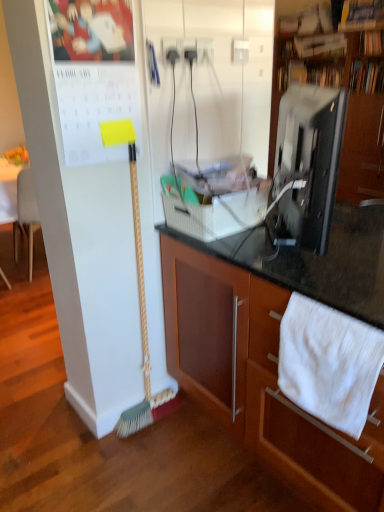
Question: Is white cotton towel at lower right inside or outside of green bristle broom at left?

Choices:
 (A) outside
 (B) inside

Answer: (A)

Question: From the image's perspective, is white cotton towel at lower right above or below green bristle broom at left?

Choices:
 (A) above
 (B) below

Answer: (B)

Question: Which object is positioned farthest from the green bristle broom at left?

Choices:
 (A) wooden cabinet at center, the 2th cabinetry in the back-to-front sequence
 (B) black glossy cabinet at upper right, the 1th cabinetry when ordered from top to bottom
 (C) white cotton towel at lower right
 (D) black glossy monitor at upper right

Answer: (B)

Question: Which of these objects is positioned closest to the black glossy cabinet at upper right, which is counted as the second cabinetry, starting from the front?

Choices:
 (A) white cotton towel at lower right
 (B) black glossy monitor at upper right
 (C) green bristle broom at left
 (D) wooden cabinet at center, which is the 1th cabinetry from bottom to top

Answer: (B)